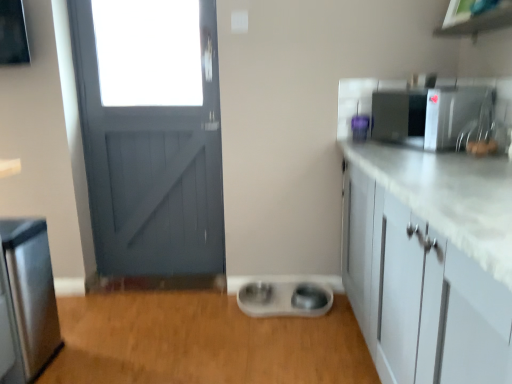
Question: Is satin nickel faucet at upper right outside of white plastic pet bowls at center?

Choices:
 (A) no
 (B) yes

Answer: (B)

Question: From a real-world perspective, is satin nickel faucet at upper right beneath white plastic pet bowls at center?

Choices:
 (A) no
 (B) yes

Answer: (A)

Question: From the image's perspective, is satin nickel faucet at upper right under white plastic pet bowls at center?

Choices:
 (A) no
 (B) yes

Answer: (A)

Question: Is satin nickel faucet at upper right smaller than white plastic pet bowls at center?

Choices:
 (A) no
 (B) yes

Answer: (B)

Question: Considering the relative positions of satin nickel faucet at upper right and white plastic pet bowls at center in the image provided, is satin nickel faucet at upper right to the left of white plastic pet bowls at center from the viewer's perspective?

Choices:
 (A) yes
 (B) no

Answer: (B)

Question: Would you say satin nickel faucet at upper right is inside or outside satin silver microwave at upper right, marked as the third appliance in a left-to-right arrangement?

Choices:
 (A) inside
 (B) outside

Answer: (B)

Question: Relative to satin silver microwave at upper right, the 3th appliance positioned from the bottom, is satin nickel faucet at upper right in front or behind?

Choices:
 (A) front
 (B) behind

Answer: (A)

Question: Looking at their shapes, would you say satin nickel faucet at upper right is wider or thinner than satin silver microwave at upper right, the 3th appliance positioned from the bottom?

Choices:
 (A) thin
 (B) wide

Answer: (A)

Question: From a real-world perspective, is satin nickel faucet at upper right physically located above or below satin silver microwave at upper right, the 3th appliance positioned from the bottom?

Choices:
 (A) above
 (B) below

Answer: (A)

Question: Which is correct: purple plastic container at upper right, the second appliance positioned from the bottom, is inside stainless steel refrigerator at left, which is counted as the 3th appliance, starting from the right, or outside of it?

Choices:
 (A) inside
 (B) outside

Answer: (B)

Question: Relative to stainless steel refrigerator at left, which is counted as the 3th appliance, starting from the right, is purple plastic container at upper right, which is the 2th appliance from left to right, in front or behind?

Choices:
 (A) front
 (B) behind

Answer: (B)

Question: Is point (364, 119) positioned closer to the camera than point (31, 334)?

Choices:
 (A) closer
 (B) farther

Answer: (B)

Question: Looking at their shapes, would you say purple plastic container at upper right, the second appliance positioned from the bottom, is wider or thinner than stainless steel refrigerator at left, which is counted as the 1th appliance, starting from the bottom?

Choices:
 (A) wide
 (B) thin

Answer: (B)

Question: In the image, is stainless steel refrigerator at left, which is counted as the 1th appliance, starting from the bottom, on the left side or the right side of satin silver microwave at upper right, the 3th appliance positioned from the bottom?

Choices:
 (A) left
 (B) right

Answer: (A)

Question: From the image's perspective, is stainless steel refrigerator at left, which is counted as the first appliance, starting from the left, above or below satin silver microwave at upper right, acting as the 1th appliance starting from the right?

Choices:
 (A) below
 (B) above

Answer: (A)